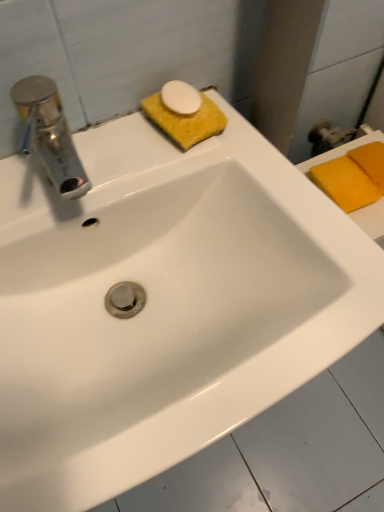
The image size is (384, 512). What are the coordinates of `vacant area that lies in front of yellow sponge at upper center, positioned as the 1th soap in left-to-right order` in the screenshot? It's located at (199, 170).